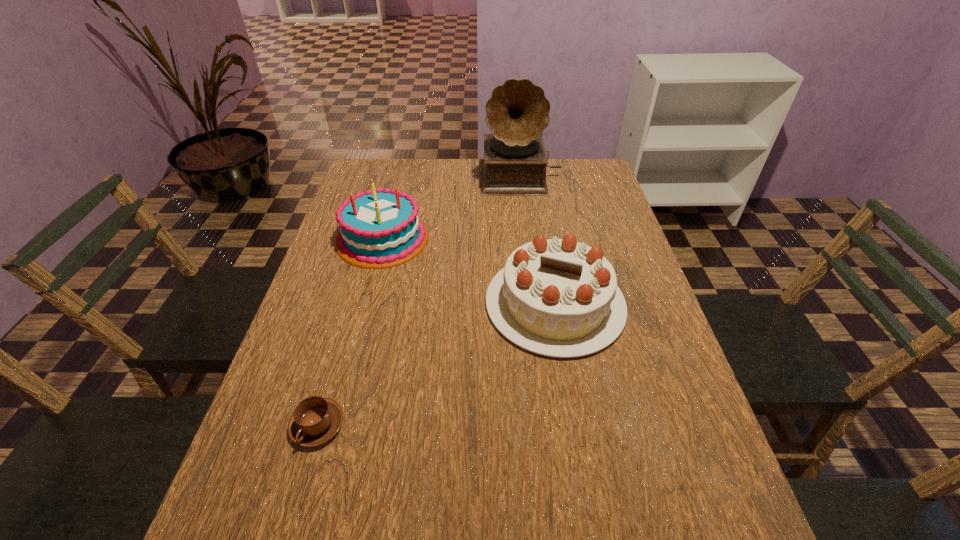
Locate an element on the screen. The height and width of the screenshot is (540, 960). object at the far edge is located at coordinates (514, 164).

In order to click on birthday cake present at the left edge in this screenshot , I will do `click(381, 228)`.

Locate an element on the screen. cappuccino that is at the left edge is located at coordinates (315, 420).

Image resolution: width=960 pixels, height=540 pixels. Identify the location of record player that is positioned at the right edge. coord(514,164).

You are a GUI agent. You are given a task and a screenshot of the screen. Output one action in this format:
    pyautogui.click(x=<x>, y=<y>)
    Task: Click on the birthday cake located at the right edge
    The width and height of the screenshot is (960, 540).
    Given the screenshot: What is the action you would take?
    pyautogui.click(x=558, y=297)

Locate an element on the screen. Image resolution: width=960 pixels, height=540 pixels. object present at the far right corner is located at coordinates (514, 164).

I want to click on free location at the far edge of the desktop, so click(559, 184).

Where is `free space at the left edge of the desktop`? free space at the left edge of the desktop is located at coordinates (244, 481).

In the image, there is a desktop. Identify the location of vacant region at the right edge. (636, 423).

Locate an element on the screen. The image size is (960, 540). vacant space at the far left corner of the desktop is located at coordinates (358, 181).